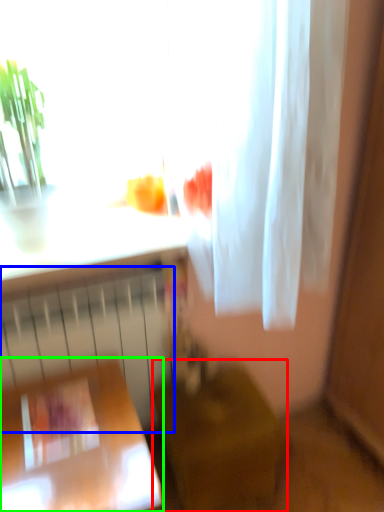
Question: Which object is positioned farthest from furniture (highlighted by a red box)? Select from radiator (highlighted by a blue box) and furniture (highlighted by a green box).

Choices:
 (A) radiator
 (B) furniture

Answer: (B)